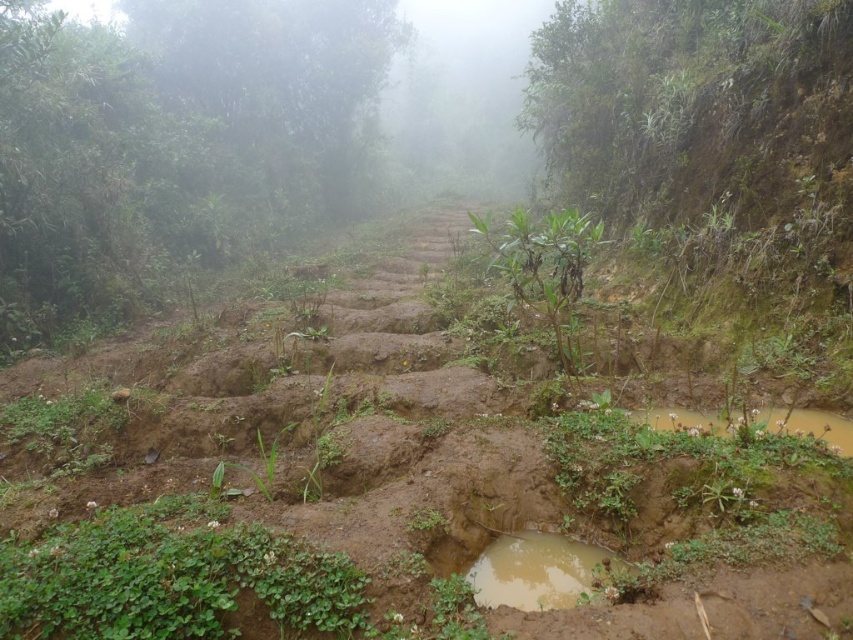
Question: Which point is farther to the camera?

Choices:
 (A) brown muddy steps at center
 (B) green leafy plants at upper left
 (C) muddy wet puddle at lower center

Answer: (B)

Question: Does brown muddy steps at center appear on the right side of green leafy plants at upper left?

Choices:
 (A) yes
 (B) no

Answer: (A)

Question: Is brown muddy steps at center above muddy wet puddle at lower center?

Choices:
 (A) no
 (B) yes

Answer: (B)

Question: Is green leafy plants at upper left wider than muddy wet puddle at lower center?

Choices:
 (A) yes
 (B) no

Answer: (A)

Question: Which object appears closest to the camera in this image?

Choices:
 (A) brown muddy steps at center
 (B) green leafy plants at upper left
 (C) muddy wet puddle at lower center

Answer: (A)

Question: Which point is closer to the camera?

Choices:
 (A) (361, 349)
 (B) (555, 556)
 (C) (256, 122)

Answer: (B)